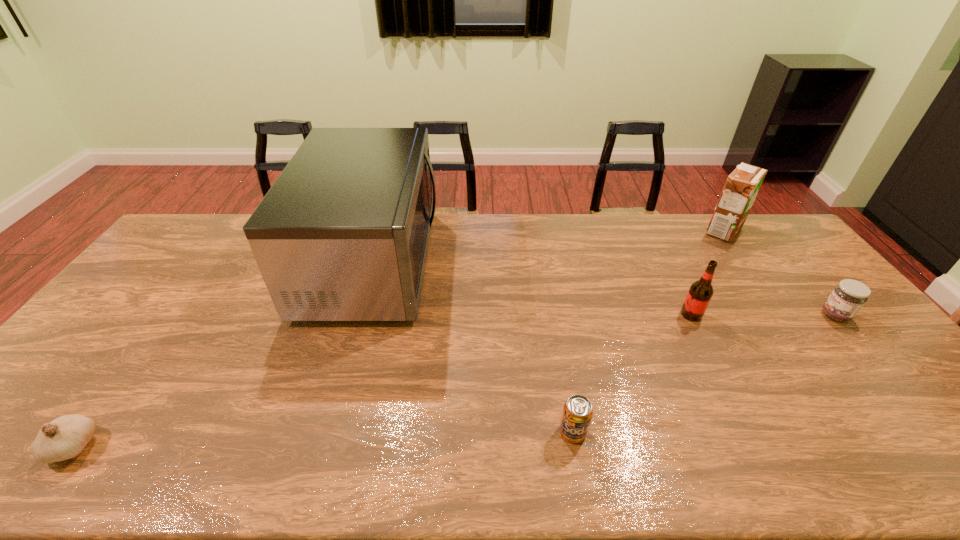
At what (x,y) coordinates should I click in order to perform the action: click on vacant space that's between the garlic and the second object from right to left. Please return your answer as a coordinate pair (x, y). This screenshot has width=960, height=540. Looking at the image, I should click on (398, 339).

Identify the location of free area in between the root beer and the garlic. (382, 380).

Select which object appears as the fifth closest to the leftmost object. Please provide its 2D coordinates. Your answer should be formatted as a tuple, i.e. [(x, y)], where the tuple contains the x and y coordinates of a point satisfying the conditions above.

[(848, 297)]

The image size is (960, 540). I want to click on the closest object to the third object from right to left, so click(848, 297).

You are a GUI agent. You are given a task and a screenshot of the screen. Output one action in this format:
    pyautogui.click(x=<x>, y=<y>)
    Task: Click on the free spot that satisfies the following two spatial constraints: 1. on the back side of the fourth object from left to right; 2. on the right side of the garlic
    
    Given the screenshot: What is the action you would take?
    pyautogui.click(x=170, y=314)

Where is `vacant space that satisfies the following two spatial constraints: 1. on the front-facing side of the third object from left to right; 2. on the right side of the microwave oven`? The height and width of the screenshot is (540, 960). vacant space that satisfies the following two spatial constraints: 1. on the front-facing side of the third object from left to right; 2. on the right side of the microwave oven is located at coordinates (323, 432).

Identify the location of free space that satisfies the following two spatial constraints: 1. on the front label of the rightmost object; 2. on the front side of the third object from left to right. (933, 432).

This screenshot has height=540, width=960. I want to click on vacant space that satisfies the following two spatial constraints: 1. on the straw side of the fifth shortest object; 2. on the front side of the leftmost object, so click(877, 446).

Locate an element on the screen. This screenshot has width=960, height=540. vacant point that satisfies the following two spatial constraints: 1. on the back side of the third object from left to right; 2. on the right side of the leftmost object is located at coordinates (84, 432).

Identify the location of vacant position in the image that satisfies the following two spatial constraints: 1. on the straw side of the fifth object from left to right; 2. on the front side of the fourth object from right to left. (868, 432).